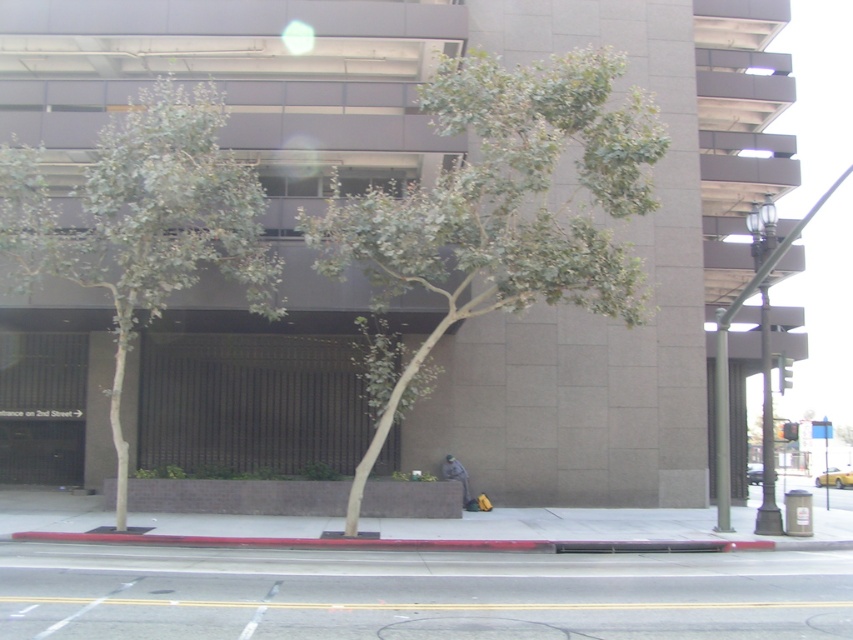
Can you confirm if green leafy tree at left is shorter than red rubber curb at lower center?

No, green leafy tree at left is not shorter than red rubber curb at lower center.

Does green leafy tree at left appear on the right side of red rubber curb at lower center?

In fact, green leafy tree at left is to the left of red rubber curb at lower center.

Between point (115, 324) and point (370, 547), which one is positioned behind?

The point (115, 324) is more distant.

The height and width of the screenshot is (640, 853). What are the coordinates of `green leafy tree at left` in the screenshot? It's located at (143, 221).

Which is more to the left, gray asphalt at lower center or red rubber curb at lower center?

Positioned to the left is red rubber curb at lower center.

Is gray asphalt at lower center to the left of red rubber curb at lower center from the viewer's perspective?

No, gray asphalt at lower center is not to the left of red rubber curb at lower center.

Is point (77, 618) more distant than point (781, 547)?

No, (77, 618) is in front of (781, 547).

Identify the location of gray asphalt at lower center. This screenshot has height=640, width=853. (421, 595).

Is gray asphalt at lower center to the right of green leafy tree at left from the viewer's perspective?

Correct, you'll find gray asphalt at lower center to the right of green leafy tree at left.

Does point (759, 563) come farther from viewer compared to point (244, 243)?

No.

Locate an element on the screen. Image resolution: width=853 pixels, height=640 pixels. gray asphalt at lower center is located at coordinates (421, 595).